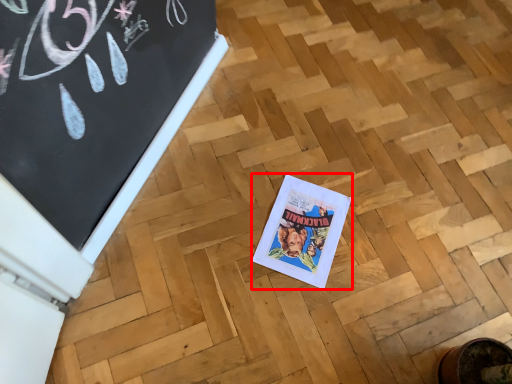
Question: In this image, where is comic book (annotated by the red box) located relative to bulletin board?

Choices:
 (A) right
 (B) left

Answer: (A)